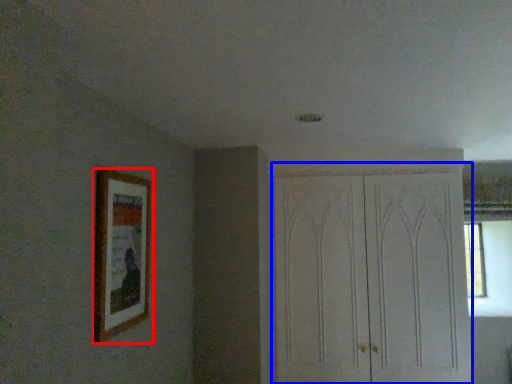
Question: Which object is further to the camera taking this photo, picture frame (highlighted by a red box) or dresser (highlighted by a blue box)?

Choices:
 (A) picture frame
 (B) dresser

Answer: (B)